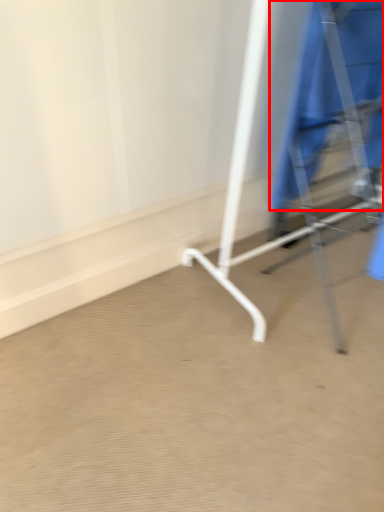
Question: Where is robe (annotated by the red box) located in relation to furniture in the image?

Choices:
 (A) right
 (B) left

Answer: (B)